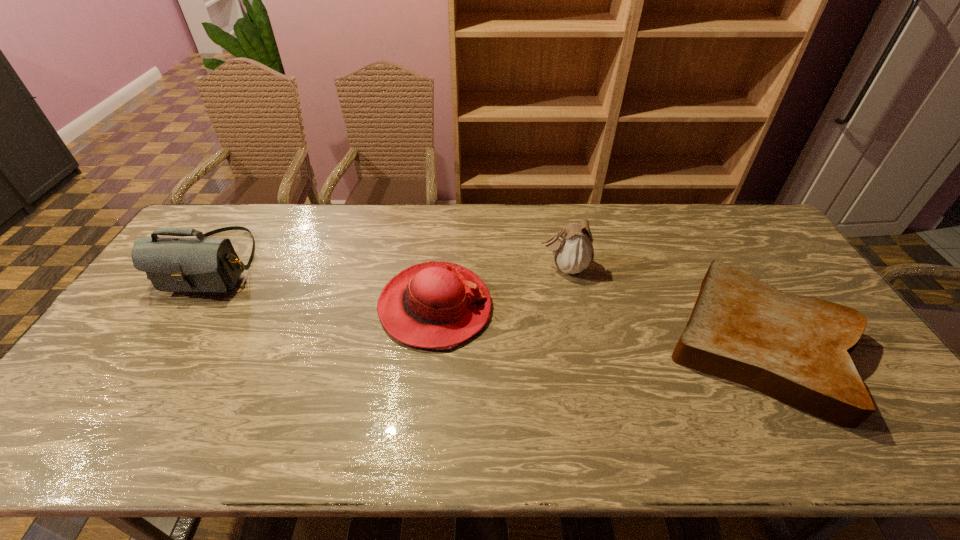
In order to click on free space between the third object from left to right and the leftmost object in this screenshot , I will do `click(390, 265)`.

Find the location of `free space between the second tallest object and the leftmost object`. free space between the second tallest object and the leftmost object is located at coordinates (390, 265).

Identify which object is the second closest to the pouch. Please provide its 2D coordinates. Your answer should be formatted as a tuple, i.e. [(x, y)], where the tuple contains the x and y coordinates of a point satisfying the conditions above.

[(438, 305)]

This screenshot has height=540, width=960. I want to click on the third closest object to the pouch, so [201, 264].

Identify the location of vacant space that satisfies the following two spatial constraints: 1. at the front of the hat with a bow; 2. on the left side of the rightmost object. (432, 343).

In order to click on free spot that satisfies the following two spatial constraints: 1. on the front-facing side of the pouch; 2. on the right side of the rightmost object in this screenshot , I will do `click(580, 343)`.

Where is `free location that satisfies the following two spatial constraints: 1. on the back side of the rightmost object; 2. on the front-facing side of the third object from left to right`? This screenshot has width=960, height=540. free location that satisfies the following two spatial constraints: 1. on the back side of the rightmost object; 2. on the front-facing side of the third object from left to right is located at coordinates (716, 267).

You are a GUI agent. You are given a task and a screenshot of the screen. Output one action in this format:
    pyautogui.click(x=<x>, y=<y>)
    Task: Click on the vacant space that satisfies the following two spatial constraints: 1. at the front of the rightmost object with a bow; 2. on the right side of the hat
    The width and height of the screenshot is (960, 540).
    Given the screenshot: What is the action you would take?
    pyautogui.click(x=432, y=343)

Identify the location of free space in the image that satisfies the following two spatial constraints: 1. at the front of the third object from right to left with a bow; 2. on the back side of the bread. (432, 343).

At what (x,y) coordinates should I click in order to perform the action: click on vacant region that satisfies the following two spatial constraints: 1. on the front-facing side of the bread; 2. on the left side of the second tallest object. Please return your answer as a coordinate pair (x, y). The image size is (960, 540). Looking at the image, I should click on (580, 343).